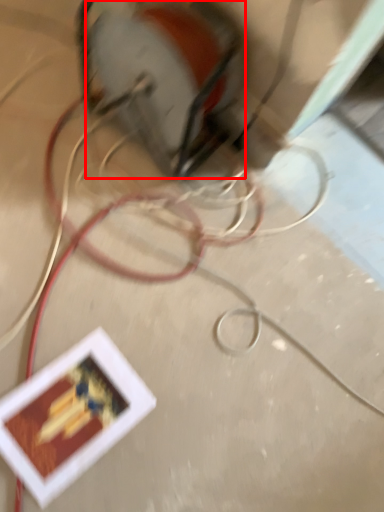
Question: From the image's perspective, where is power plugs and sockets (annotated by the red box) located relative to wire?

Choices:
 (A) above
 (B) below

Answer: (A)